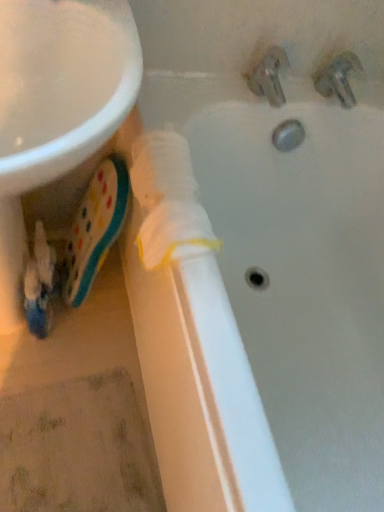
Question: Considering the relative positions of metallic silver tap at upper right, the 2th tap when ordered from left to right, and white matte pipe at center in the image provided, is metallic silver tap at upper right, the 2th tap when ordered from left to right, behind white matte pipe at center?

Choices:
 (A) no
 (B) yes

Answer: (B)

Question: Is metallic silver tap at upper right, marked as the 1th tap in a right-to-left arrangement, smaller than white matte pipe at center?

Choices:
 (A) yes
 (B) no

Answer: (A)

Question: Does metallic silver tap at upper right, marked as the 1th tap in a right-to-left arrangement, have a lesser width compared to white matte pipe at center?

Choices:
 (A) yes
 (B) no

Answer: (A)

Question: Is metallic silver tap at upper right, marked as the 1th tap in a right-to-left arrangement, aimed at white matte pipe at center?

Choices:
 (A) yes
 (B) no

Answer: (B)

Question: Is metallic silver tap at upper right, marked as the 1th tap in a right-to-left arrangement, outside of white matte pipe at center?

Choices:
 (A) yes
 (B) no

Answer: (A)

Question: Considering their positions, is matte plastic toothpaste at lower left located in front of or behind white matte pipe at center?

Choices:
 (A) behind
 (B) front

Answer: (A)

Question: Considering the positions of point (84, 228) and point (299, 403), is point (84, 228) closer or farther from the camera than point (299, 403)?

Choices:
 (A) closer
 (B) farther

Answer: (B)

Question: In terms of height, does matte plastic toothpaste at lower left look taller or shorter compared to white matte pipe at center?

Choices:
 (A) short
 (B) tall

Answer: (A)

Question: Choose the correct answer: Is matte plastic toothpaste at lower left inside white matte pipe at center or outside it?

Choices:
 (A) outside
 (B) inside

Answer: (A)

Question: Considering the positions of white matte pipe at center and metallic silver tap at upper right, the 2th tap when ordered from left to right, in the image, is white matte pipe at center taller or shorter than metallic silver tap at upper right, the 2th tap when ordered from left to right,?

Choices:
 (A) tall
 (B) short

Answer: (A)

Question: Considering the positions of white matte pipe at center and metallic silver tap at upper right, marked as the 1th tap in a right-to-left arrangement, in the image, is white matte pipe at center bigger or smaller than metallic silver tap at upper right, marked as the 1th tap in a right-to-left arrangement,?

Choices:
 (A) small
 (B) big

Answer: (B)

Question: Is white matte pipe at center to the left or to the right of metallic silver tap at upper right, marked as the 1th tap in a right-to-left arrangement, in the image?

Choices:
 (A) left
 (B) right

Answer: (A)

Question: From a real-world perspective, is white matte pipe at center physically located above or below metallic silver tap at upper right, the 2th tap when ordered from left to right?

Choices:
 (A) above
 (B) below

Answer: (B)

Question: Does point (326, 90) appear closer or farther from the camera than point (259, 83)?

Choices:
 (A) farther
 (B) closer

Answer: (A)

Question: Is metallic silver tap at upper right, marked as the 1th tap in a right-to-left arrangement, taller or shorter than metallic chrome faucet at upper right, the second tap viewed from the right?

Choices:
 (A) short
 (B) tall

Answer: (A)